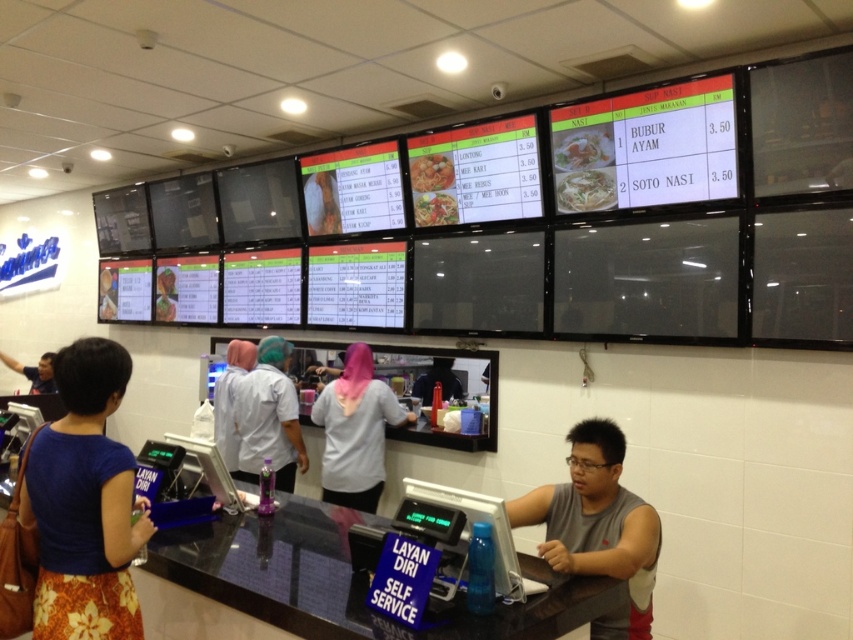
Which is below, white fabric shirt at center or white fabric uniform at center?

Positioned lower is white fabric shirt at center.

Does white fabric shirt at center have a greater height compared to white fabric uniform at center?

Correct, white fabric shirt at center is much taller as white fabric uniform at center.

Which is behind, point (351, 486) or point (215, 416)?

Point (215, 416)

Find the location of `white fabric shirt at center`. white fabric shirt at center is located at coordinates (355, 432).

Does white glossy noodles at center appear over shiny orange fried rice at center?

No.

Consider the image. Who is positioned more to the left, white glossy noodles at center or shiny orange fried rice at center?

shiny orange fried rice at center

Who is more distant from viewer, (581, 186) or (437, 179)?

The point (437, 179) is more distant.

Locate an element on the screen. This screenshot has width=853, height=640. white glossy noodles at center is located at coordinates (585, 189).

Does white uniform at center have a lesser width compared to white fabric uniform at center?

Incorrect, white uniform at center's width is not less than white fabric uniform at center's.

Who is higher up, white uniform at center or white fabric uniform at center?

white fabric uniform at center is higher up.

This screenshot has width=853, height=640. Find the location of `white uniform at center`. white uniform at center is located at coordinates (268, 417).

Identify the location of white uniform at center. (268, 417).